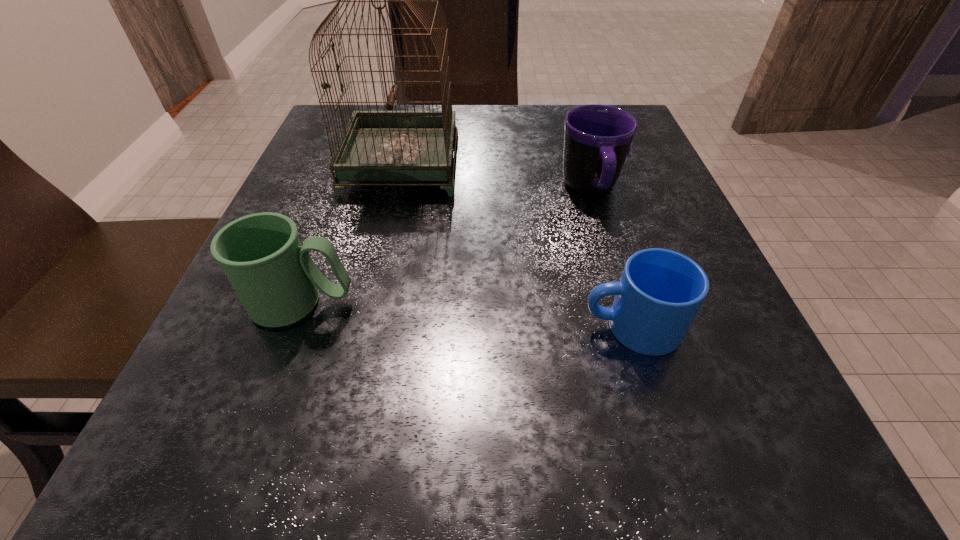
Image resolution: width=960 pixels, height=540 pixels. What are the coordinates of `object that is the second closest one to the farthest mug` in the screenshot? It's located at (376, 146).

The image size is (960, 540). Find the location of `object that is the second closest to the farthest mug`. object that is the second closest to the farthest mug is located at coordinates (376, 146).

You are a GUI agent. You are given a task and a screenshot of the screen. Output one action in this format:
    pyautogui.click(x=<x>, y=<y>)
    Task: Click on the mug that stands as the closest to the shortest mug
    The height and width of the screenshot is (540, 960).
    Given the screenshot: What is the action you would take?
    pyautogui.click(x=597, y=138)

Point out which mug is positioned as the nearest to the farthest mug. Please provide its 2D coordinates. Your answer should be formatted as a tuple, i.e. [(x, y)], where the tuple contains the x and y coordinates of a point satisfying the conditions above.

[(660, 291)]

In order to click on vacant area that satisfies the following two spatial constraints: 1. with the handle on the side of the farthest mug; 2. on the side of the leftmost mug with the handle in this screenshot , I will do coord(624,303).

This screenshot has width=960, height=540. Find the location of `free space that satisfies the following two spatial constraints: 1. with the handle on the side of the farthest mug; 2. on the side of the leftmost mug with the handle`. free space that satisfies the following two spatial constraints: 1. with the handle on the side of the farthest mug; 2. on the side of the leftmost mug with the handle is located at coordinates (624, 303).

The height and width of the screenshot is (540, 960). What are the coordinates of `vacant point that satisfies the following two spatial constraints: 1. with the handle on the side of the farthest mug; 2. on the side of the leftmost mug with the handle` in the screenshot? It's located at [x=624, y=303].